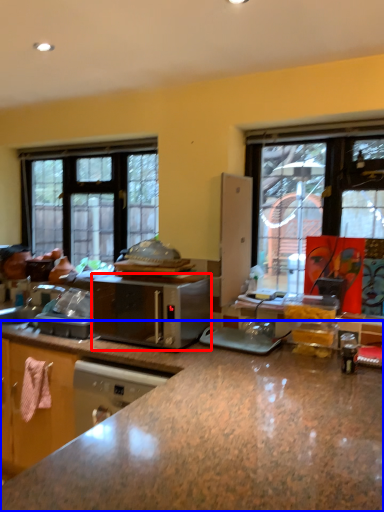
Question: Which point is closer to the camera, microwave oven (highlighted by a red box) or countertop (highlighted by a blue box)?

Choices:
 (A) microwave oven
 (B) countertop

Answer: (B)